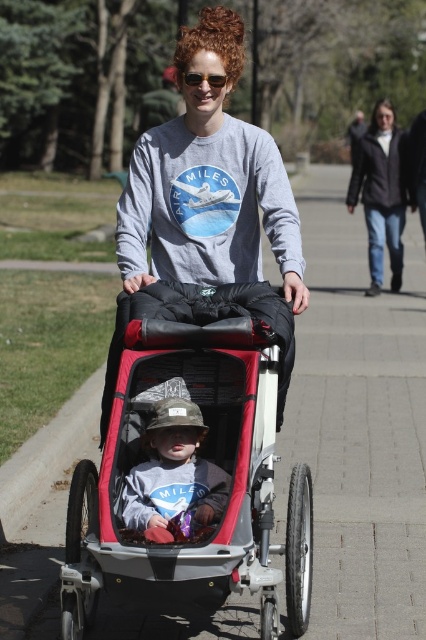
Question: Is red fabric stroller at center wider than dark gray leather jacket at upper center?

Choices:
 (A) no
 (B) yes

Answer: (A)

Question: Can you confirm if dark gray fleece sweatshirt at upper right is positioned above gold reflective sunglasses at center?

Choices:
 (A) no
 (B) yes

Answer: (B)

Question: Which point appears farthest from the camera in this image?

Choices:
 (A) (391, 232)
 (B) (195, 74)
 (C) (213, 99)

Answer: (A)

Question: Which object is the farthest from the dark gray fleece sweatshirt at upper right?

Choices:
 (A) gold reflective sunglasses at center
 (B) dark gray leather jacket at upper center
 (C) red fabric stroller at center
 (D) camouflage fabric hat at center

Answer: (D)

Question: Which of the following is the farthest from the observer?

Choices:
 (A) (x=192, y=84)
 (B) (x=117, y=211)
 (C) (x=201, y=528)

Answer: (B)

Question: Does dark gray fleece sweatshirt at upper right appear on the left side of gold reflective sunglasses at center?

Choices:
 (A) yes
 (B) no

Answer: (B)